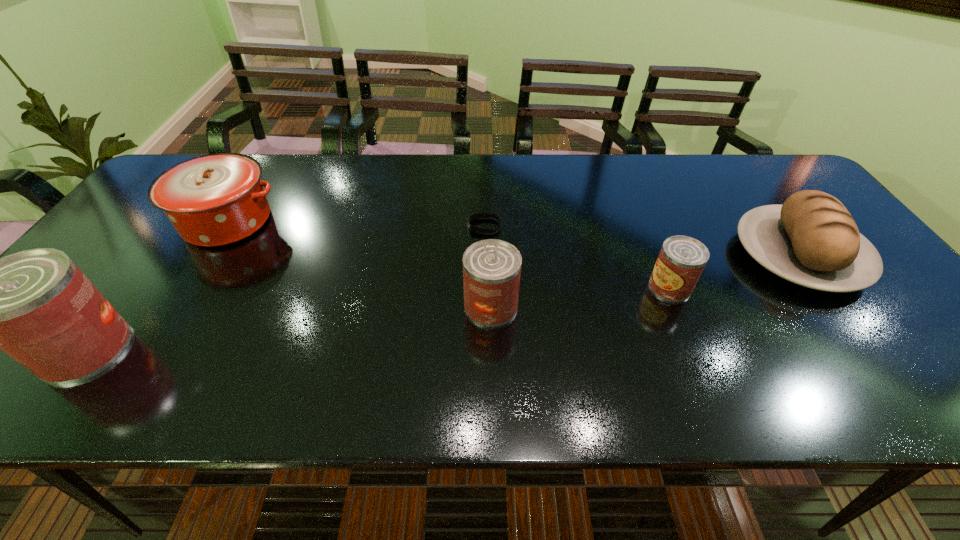
The width and height of the screenshot is (960, 540). Find the location of `vacant space that is in between the second tallest can and the rightmost can`. vacant space that is in between the second tallest can and the rightmost can is located at coordinates (581, 296).

Identify the location of empty space that is in between the bread and the second tallest can. Image resolution: width=960 pixels, height=540 pixels. (645, 281).

Locate an element on the screen. This screenshot has height=540, width=960. free space that is in between the shortest can and the tallest object is located at coordinates (378, 318).

Where is `empty space between the casserole and the wristband`? Image resolution: width=960 pixels, height=540 pixels. empty space between the casserole and the wristband is located at coordinates (356, 224).

At what (x,y) coordinates should I click in order to perform the action: click on empty location between the shortest object and the casserole. Please return your answer as a coordinate pair (x, y). This screenshot has width=960, height=540. Looking at the image, I should click on pos(356,224).

Locate an element on the screen. vacant area that lies between the wristband and the casserole is located at coordinates (356, 224).

At what (x,y) coordinates should I click in order to perform the action: click on object identified as the closest to the fifth tallest object. Please return your answer as a coordinate pair (x, y). This screenshot has height=540, width=960. Looking at the image, I should click on (812, 240).

Identify which object is located as the third nearest to the second shortest object. Please provide its 2D coordinates. Your answer should be formatted as a tuple, i.e. [(x, y)], where the tuple contains the x and y coordinates of a point satisfying the conditions above.

[(478, 215)]

Locate an element on the screen. This screenshot has width=960, height=540. the third closest can to the shortest object is located at coordinates (36, 305).

Select which can appears as the second closest to the tallest can. Please provide its 2D coordinates. Your answer should be formatted as a tuple, i.e. [(x, y)], where the tuple contains the x and y coordinates of a point satisfying the conditions above.

[(681, 260)]